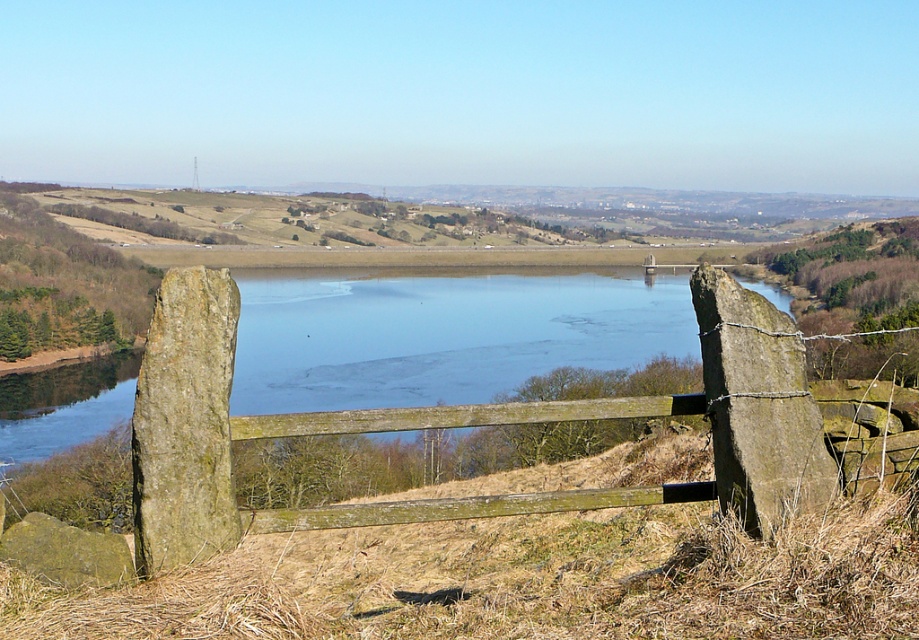
Question: In this image, where is wooden gate at center located relative to green rough stone at left?

Choices:
 (A) left
 (B) right

Answer: (A)

Question: Can you confirm if green rough stone at left is positioned to the right of rough textured stone at lower left?

Choices:
 (A) no
 (B) yes

Answer: (B)

Question: Is wooden gate at center closer to camera compared to rough textured stone at lower left?

Choices:
 (A) no
 (B) yes

Answer: (A)

Question: Which point appears closest to the camera in this image?

Choices:
 (A) (32, 513)
 (B) (6, 396)

Answer: (A)

Question: Which point is closer to the camera taking this photo?

Choices:
 (A) (256, 372)
 (B) (40, 572)

Answer: (B)

Question: Estimate the real-world distances between objects in this image. Which object is farther from the wooden gate at center?

Choices:
 (A) green rough stone at left
 (B) rough textured stone at lower left

Answer: (B)